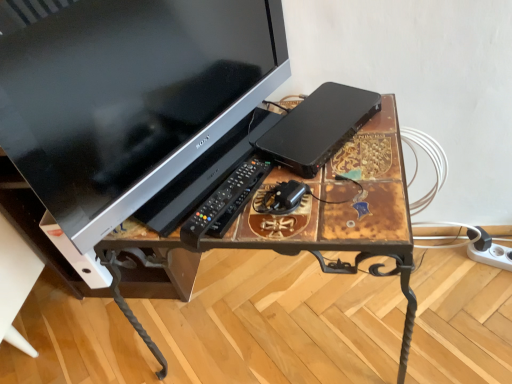
Identify the location of blank space above black plastic computer at center (from a real-world perspective). (314, 122).